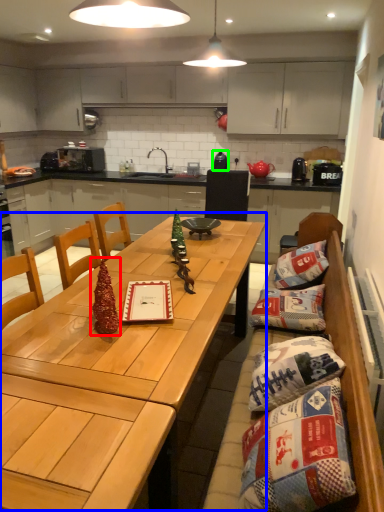
Question: Which is farther away from christmas tree (highlighted by a red box)? table (highlighted by a blue box) or appliance (highlighted by a green box)?

Choices:
 (A) table
 (B) appliance

Answer: (B)